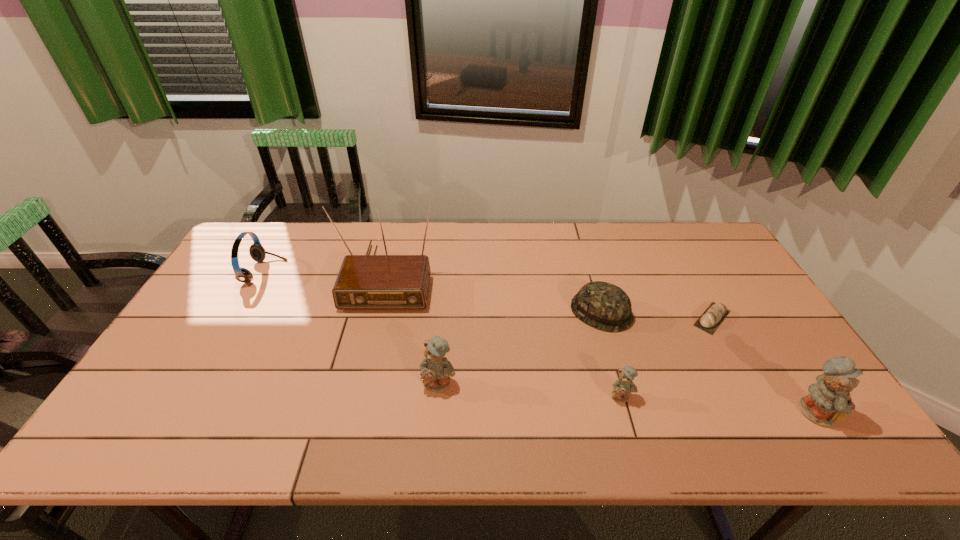
Image resolution: width=960 pixels, height=540 pixels. Find the location of `vacant space at the near edge of the desktop`. vacant space at the near edge of the desktop is located at coordinates (467, 397).

At what (x,y) coordinates should I click in order to perform the action: click on vacant area at the left edge. Please return your answer as a coordinate pair (x, y). This screenshot has width=960, height=540. Looking at the image, I should click on (234, 316).

Where is `vacant space at the right edge`? This screenshot has height=540, width=960. vacant space at the right edge is located at coordinates (726, 290).

This screenshot has height=540, width=960. What are the coordinates of `vacant space at the far left corner` in the screenshot? It's located at (247, 260).

The width and height of the screenshot is (960, 540). I want to click on blank region between the second object from right to left and the leftmost object, so click(489, 295).

At what (x,y) coordinates should I click in order to perform the action: click on vacant area between the rightmost teddy bear and the radio_receiver. Please return your answer as a coordinate pair (x, y). This screenshot has height=540, width=960. Looking at the image, I should click on (601, 343).

You are a GUI agent. You are given a task and a screenshot of the screen. Output one action in this format:
    pyautogui.click(x=<x>, y=<y>)
    Task: Click on the free space between the leftmost object and the pita bread
    The image size is (960, 540).
    Given the screenshot: What is the action you would take?
    pyautogui.click(x=489, y=295)

Where is `free space that is in between the headwear and the rightmost teddy bear`? The image size is (960, 540). free space that is in between the headwear and the rightmost teddy bear is located at coordinates (708, 361).

At what (x,y) coordinates should I click in order to perform the action: click on vacant space in between the shortest object and the rightmost teddy bear. Please return your answer as a coordinate pair (x, y). Looking at the image, I should click on (763, 364).

Where is `free point between the radio_receiver and the shortest teddy bear`? Image resolution: width=960 pixels, height=540 pixels. free point between the radio_receiver and the shortest teddy bear is located at coordinates (504, 336).